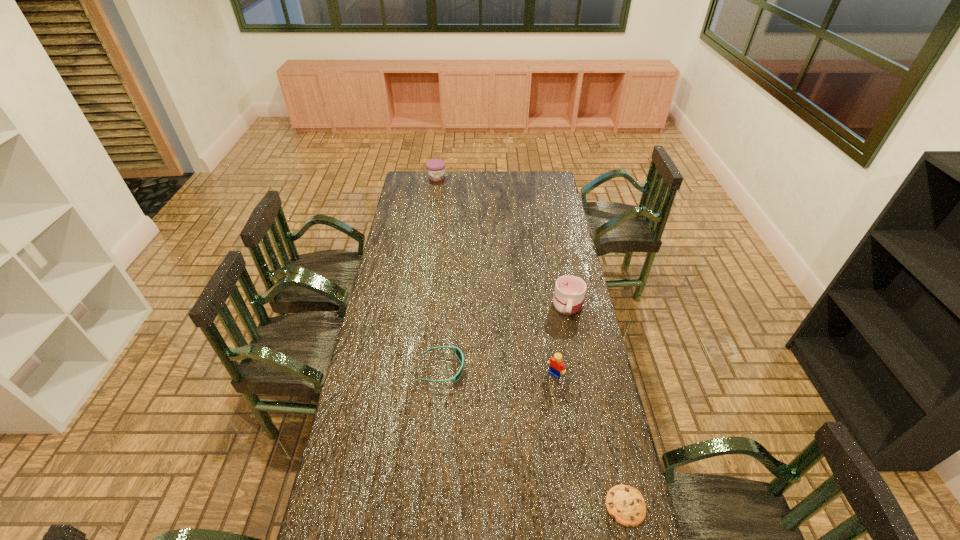
Find the location of `free spot on the desktop that is between the fourth tallest object and the cookie and is positioned on the side with the handle of the mug`. free spot on the desktop that is between the fourth tallest object and the cookie and is positioned on the side with the handle of the mug is located at coordinates (542, 443).

Where is `vacant space on the desktop that is between the fourth tallest object and the shortest object and is positioned on the front label of the farthest object`? The image size is (960, 540). vacant space on the desktop that is between the fourth tallest object and the shortest object and is positioned on the front label of the farthest object is located at coordinates (516, 424).

The width and height of the screenshot is (960, 540). I want to click on free space on the desktop that is between the fourth tallest object and the nearest object and is positioned on the face of the third object from right to left, so coord(512,421).